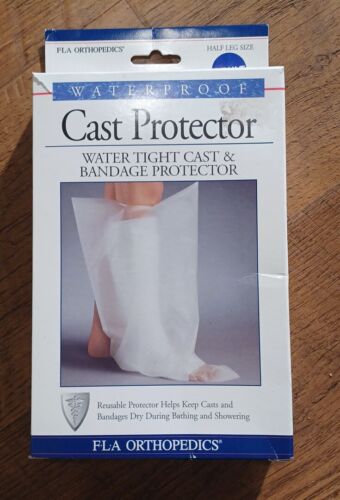
Where is `table`? table is located at coordinates (305, 468).